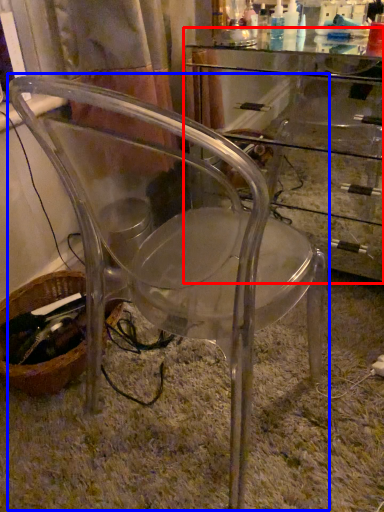
Question: Which object appears closest to the camera in this image, computer desk (highlighted by a red box) or chair (highlighted by a blue box)?

Choices:
 (A) computer desk
 (B) chair

Answer: (B)